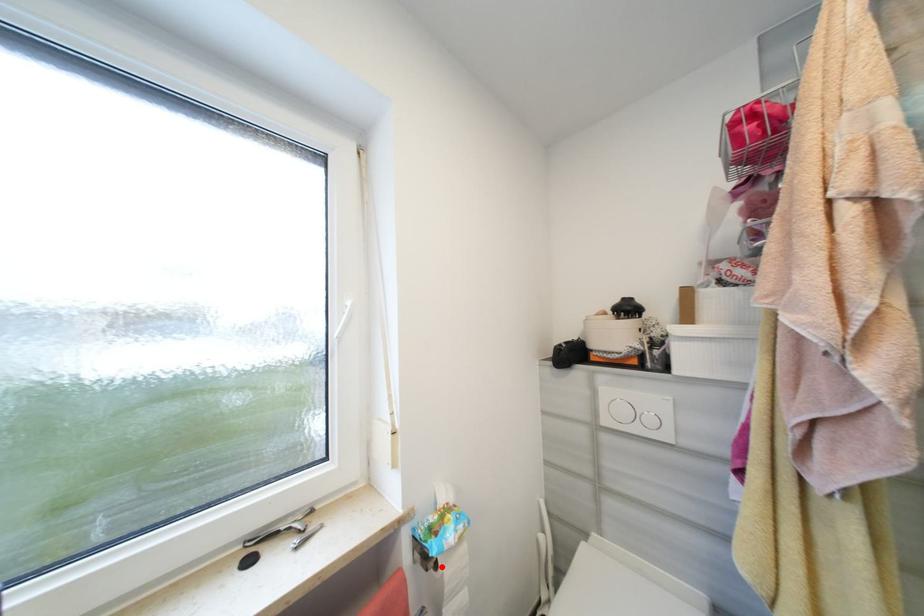
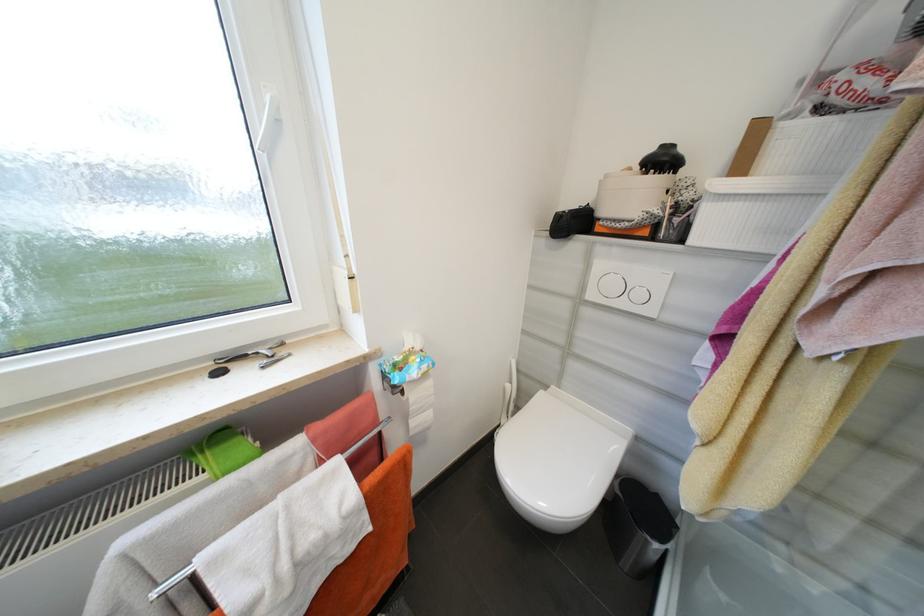
The point at the highlighted location is marked in the first image. Where is the corresponding point in the second image?

(407, 392)